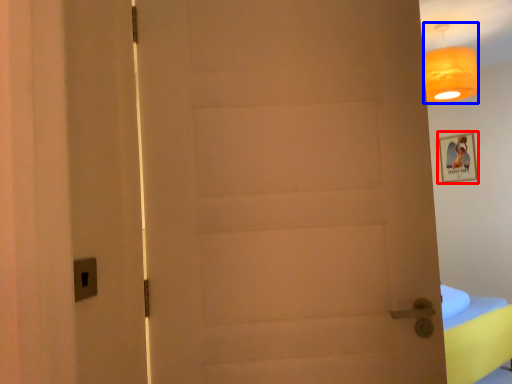
Question: Which object is further to the camera taking this photo, picture frame (highlighted by a red box) or lamp (highlighted by a blue box)?

Choices:
 (A) picture frame
 (B) lamp

Answer: (A)